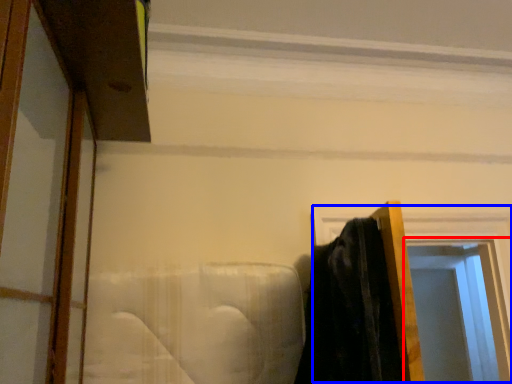
Question: Which object appears closest to the camera in this image, window (highlighted by a red box) or window frame (highlighted by a blue box)?

Choices:
 (A) window
 (B) window frame

Answer: (B)